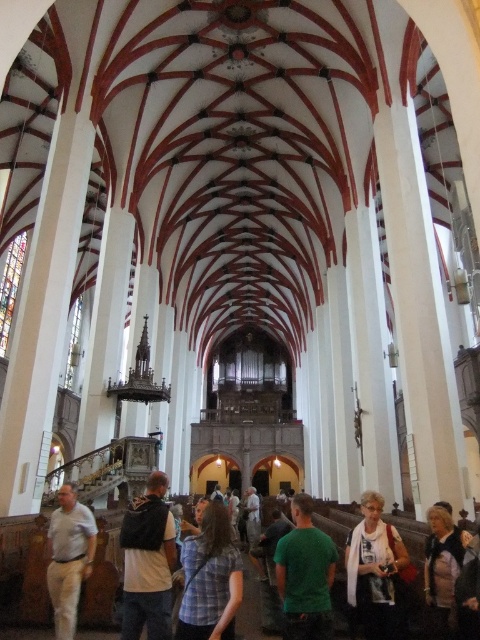
Question: Does green matte shirt at center appear under light brown leather jacket at lower right?

Choices:
 (A) yes
 (B) no

Answer: (A)

Question: Among these objects, which one is nearest to the camera?

Choices:
 (A) white cotton shirt at lower right
 (B) white cotton shirt at center
 (C) plaid shirt at center
 (D) light brown leather jacket at lower right

Answer: (C)

Question: Among these objects, which one is farthest from the camera?

Choices:
 (A) green matte shirt at center
 (B) plaid shirt at center
 (C) white cotton shirt at lower right

Answer: (C)

Question: Which object is closer to the camera taking this photo?

Choices:
 (A) plaid shirt at center
 (B) white cotton shirt at center

Answer: (A)

Question: Is white cotton shirt at lower right thinner than light brown leather jacket at lower right?

Choices:
 (A) no
 (B) yes

Answer: (A)

Question: Is the position of light beige cotton shirt at center more distant than that of light brown leather jacket at lower right?

Choices:
 (A) no
 (B) yes

Answer: (B)